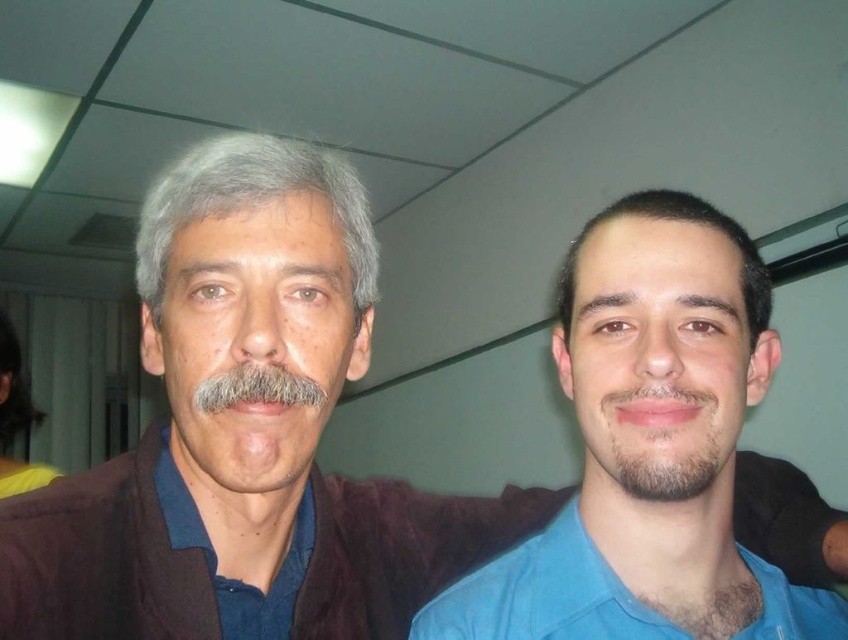
Identify the location of gray matte face at center. (254, 344).

Is point (282, 346) closer to viewer compared to point (833, 621)?

Yes, it is.

Is point (196, 285) closer to camera compared to point (495, 595)?

Yes, point (196, 285) is closer to viewer.

At what (x,y) coordinates should I click in order to perform the action: click on gray matte face at center. Please return your answer as a coordinate pair (x, y). Looking at the image, I should click on click(254, 344).

In the scene shown: Can you confirm if blue matte shirt at right is positioned above dark brown hair at center?

Incorrect, blue matte shirt at right is not positioned above dark brown hair at center.

Is blue matte shirt at right shorter than dark brown hair at center?

Incorrect, blue matte shirt at right's height does not fall short of dark brown hair at center's.

Where is `blue matte shirt at right`? This screenshot has height=640, width=848. blue matte shirt at right is located at coordinates (x=646, y=442).

Is point (633, 604) positioned after point (696, 625)?

No, (633, 604) is closer to viewer.

Who is more forward, (441, 595) or (683, 616)?

Point (683, 616) is more forward.

Locate an element on the screen. blue cotton shirt at right is located at coordinates (544, 595).